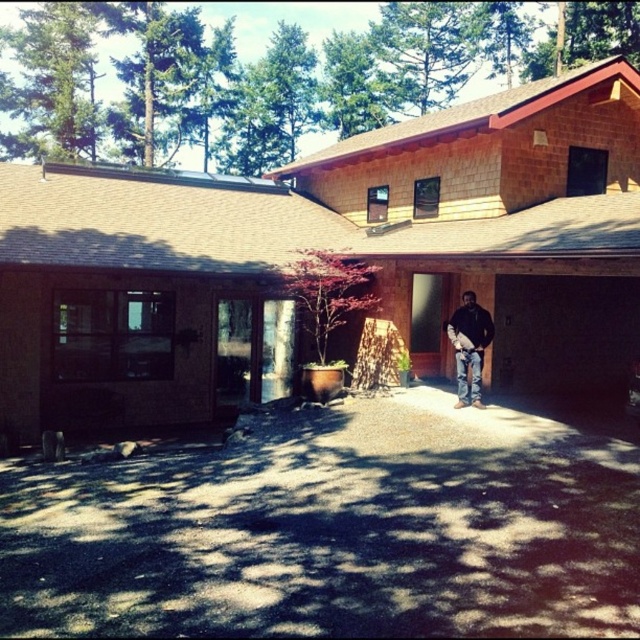
Does brown shingles at center have a larger size compared to dark asphalt driveway at center?

Yes, brown shingles at center is bigger than dark asphalt driveway at center.

Find the location of a particular element. The width and height of the screenshot is (640, 640). brown shingles at center is located at coordinates (326, 250).

Does point (122, 538) come behind point (468, 365)?

No, it is in front of (468, 365).

Measure the distance between point (588, 600) and camera.

They are 5.10 meters apart.

Which is behind, point (257, 429) or point (461, 330)?

The point (461, 330) is behind.

Image resolution: width=640 pixels, height=640 pixels. I want to click on dark asphalt driveway at center, so click(x=336, y=531).

Which is behind, point (531, 195) or point (465, 387)?

The point (531, 195) is more distant.

Does point (625, 93) come in front of point (452, 324)?

That is False.

Is point (618, 161) behind point (480, 381)?

Yes, point (618, 161) is farther from viewer.

Where is `brown shingles at center`? brown shingles at center is located at coordinates (326, 250).